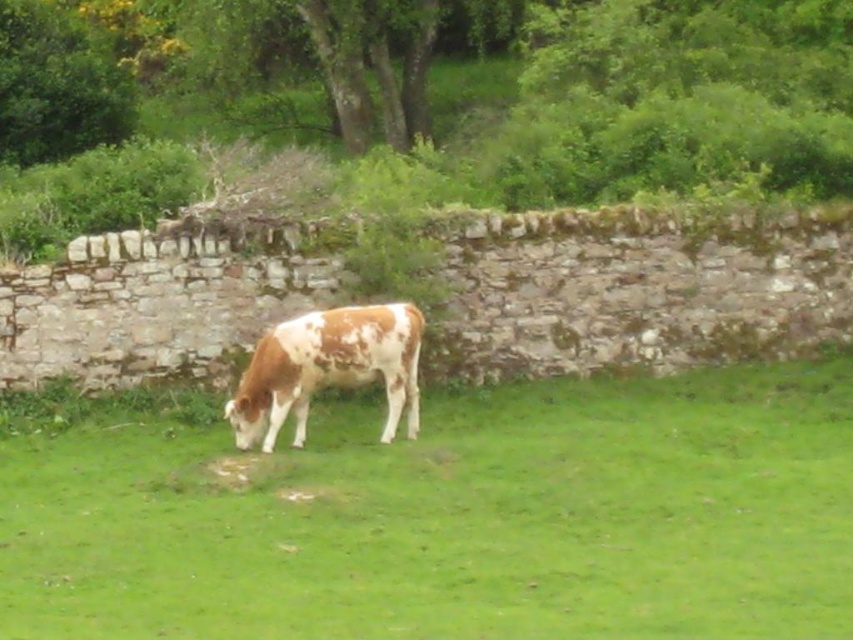
Question: Which object is closer to the camera taking this photo?

Choices:
 (A) brown speckled cow at center
 (B) speckled brown cow at center

Answer: (A)

Question: Which object appears farthest from the camera in this image?

Choices:
 (A) brown speckled cow at center
 (B) speckled brown cow at center

Answer: (B)

Question: Is brown speckled cow at center thinner than speckled brown cow at center?

Choices:
 (A) yes
 (B) no

Answer: (A)

Question: Can you confirm if brown speckled cow at center is thinner than speckled brown cow at center?

Choices:
 (A) no
 (B) yes

Answer: (B)

Question: Can you confirm if brown speckled cow at center is thinner than speckled brown cow at center?

Choices:
 (A) yes
 (B) no

Answer: (A)